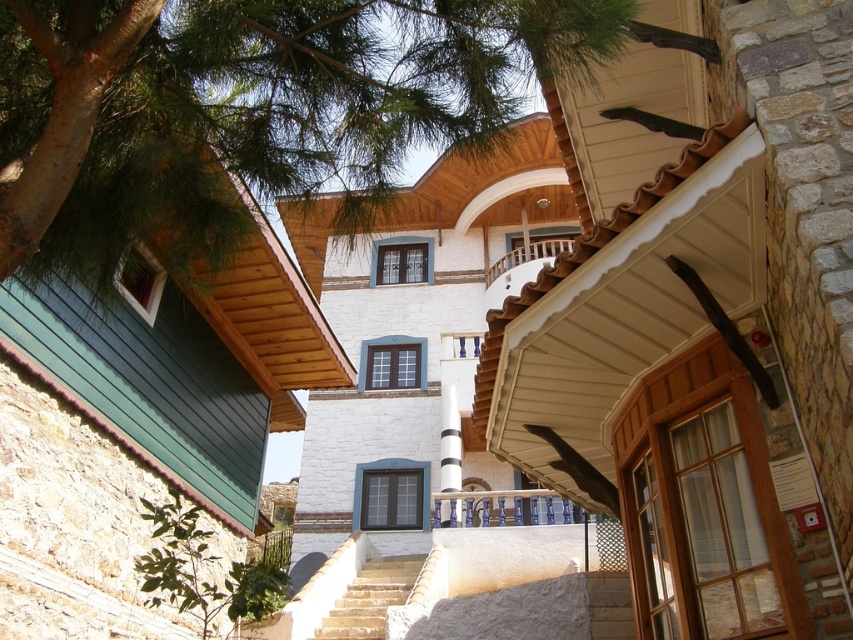
You are standing at the entrance of the Mediterranean building and want to reach the balcony. Which direction should you head from the smooth stone stairs at lower center to reach the balcony?

The smooth stone stairs at lower center is located at point (608, 605), so you should head towards the balcony from there.

You are standing in front of the building and want to take a photo that includes both the green leafy tree at lower left and the brown wooden balustrade at upper center. Which object will appear bigger in the photo?

The green leafy tree at lower left will appear bigger in the photo because it is larger in size than the brown wooden balustrade at upper center.

You are standing in front of the Mediterranean building and see two points marked on the structure. Which point, point (x=611, y=573) or point (x=540, y=244), is closer to you?

Point (x=611, y=573) is closer to the camera than point (x=540, y=244), so it is closer to you.